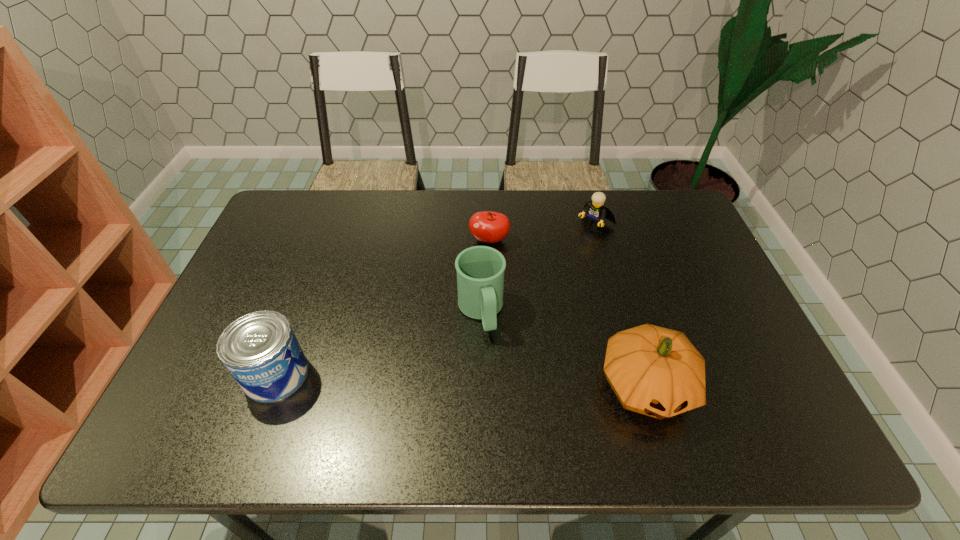
Find the location of a particular element. the leftmost object is located at coordinates (260, 350).

Where is `gourd`? gourd is located at coordinates (655, 371).

What are the coordinates of `apple` in the screenshot? It's located at (489, 227).

You are a GUI agent. You are given a task and a screenshot of the screen. Output one action in this format:
    pyautogui.click(x=<x>, y=<y>)
    Task: Click on the Lego
    The height and width of the screenshot is (540, 960).
    Given the screenshot: What is the action you would take?
    pyautogui.click(x=596, y=213)

Locate an element on the screen. This screenshot has width=960, height=540. the third nearest object is located at coordinates pyautogui.click(x=480, y=270).

Where is `free spot located 0.340m on the stem of the apple`? The image size is (960, 540). free spot located 0.340m on the stem of the apple is located at coordinates (458, 338).

You are a GUI agent. You are given a task and a screenshot of the screen. Output one action in this format:
    pyautogui.click(x=<x>, y=<y>)
    Task: Click on the free region located 0.370m on the stem of the apple
    
    Given the screenshot: What is the action you would take?
    pyautogui.click(x=455, y=347)

This screenshot has height=540, width=960. What are the coordinates of `free location located on the stem of the apple` in the screenshot? It's located at (482, 261).

The width and height of the screenshot is (960, 540). In order to click on blank area located 0.330m on the front-facing side of the Lego in this screenshot , I will do `click(524, 289)`.

At what (x,y) coordinates should I click in order to perform the action: click on free location located on the front-facing side of the Lego. Please return your answer as a coordinate pair (x, y). This screenshot has height=540, width=960. Looking at the image, I should click on (554, 261).